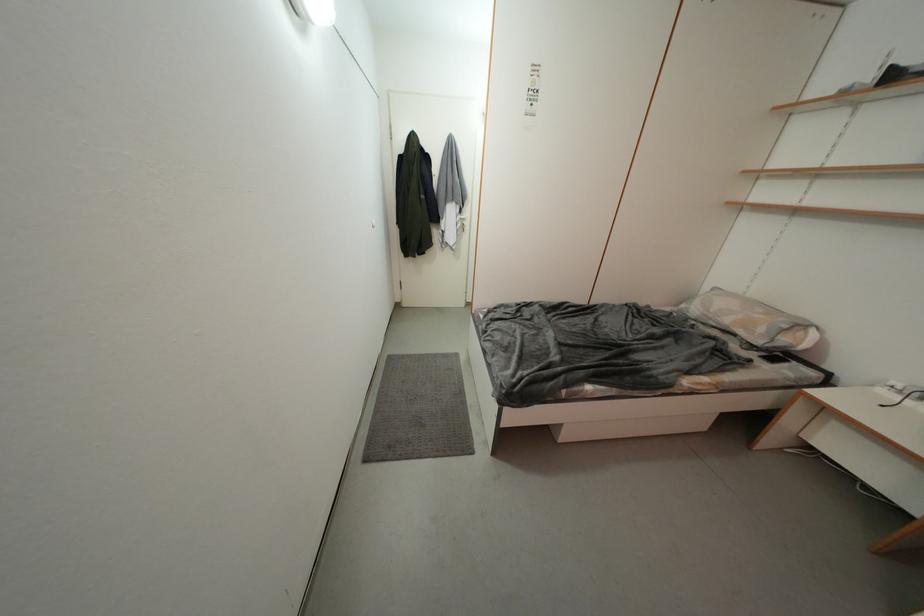
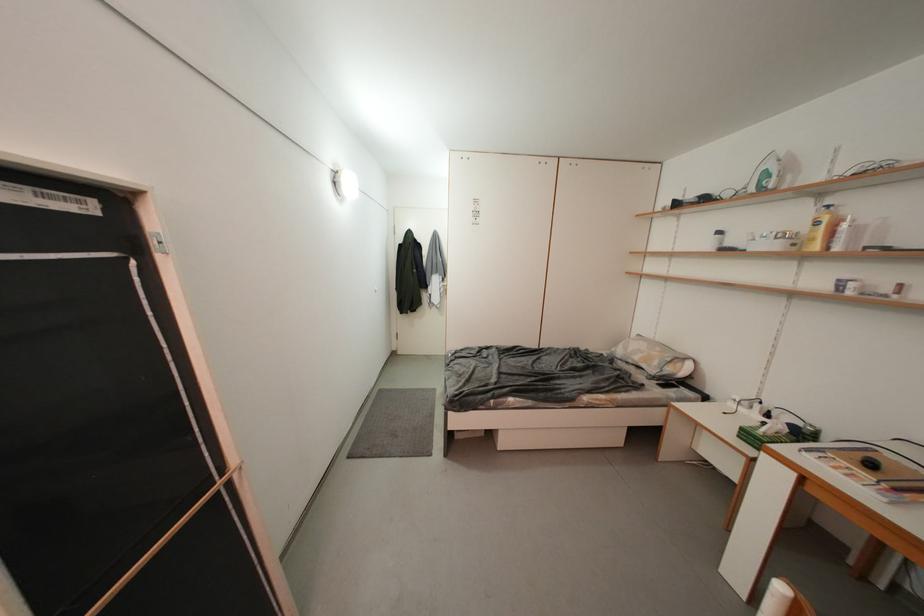
Question: The images are taken continuously from a first-person perspective. In which direction is your viewpoint rotating?

Choices:
 (A) Left
 (B) Right
 (C) Up
 (D) Down

Answer: (C)